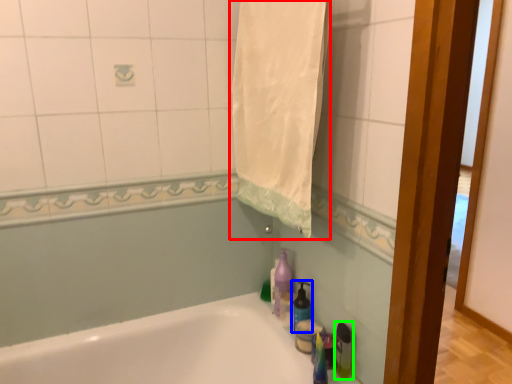
Question: Estimate the real-world distances between objects in this image. Which object is closer to bath towel (highlighted by a red box), soap dispenser (highlighted by a blue box) or bottle (highlighted by a green box)?

Choices:
 (A) soap dispenser
 (B) bottle

Answer: (A)